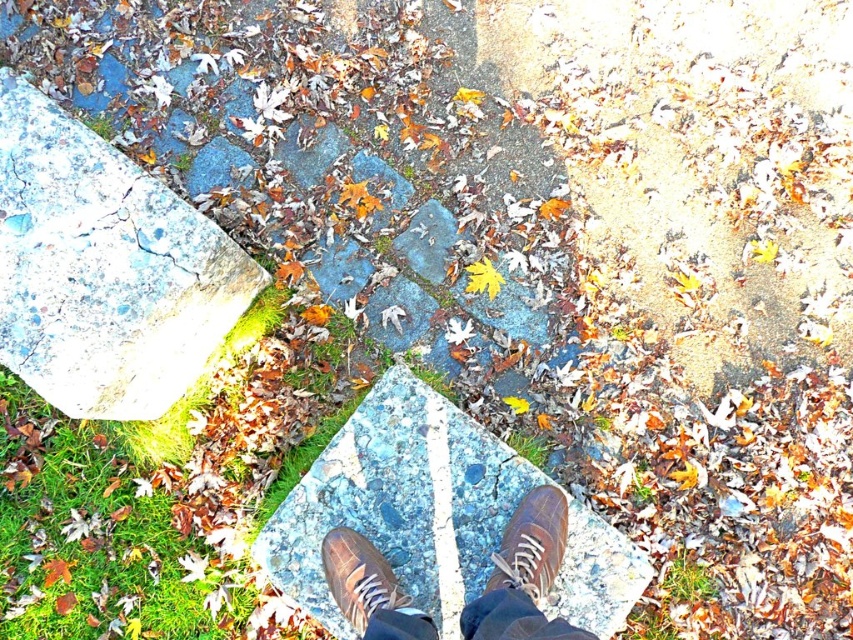
You are standing on the stone pathway and notice two brown shoes at the center of the image. Which shoe is closer to your feet, the brown leather shoe at center or the brown suede shoe at center?

The brown leather shoe at center is closer to your feet because the brown suede shoe at center is positioned behind it.

You are standing at the point marked by the coordinates point (x=154, y=499). Looking around, you see the image described. What is the nearest object to your current position?

The nearest object to your current position is the green mossy stone at lower left, as the point (x=154, y=499) marks its location.

Based on the photo, you are a drone operator trying to capture a photo of the brown leather shoes at center. The camera is positioned at point (524, 573). Is the camera directly above the shoes?

Yes, the camera is directly above the brown leather shoes at center because the point (524, 573) is where the shoes are located.